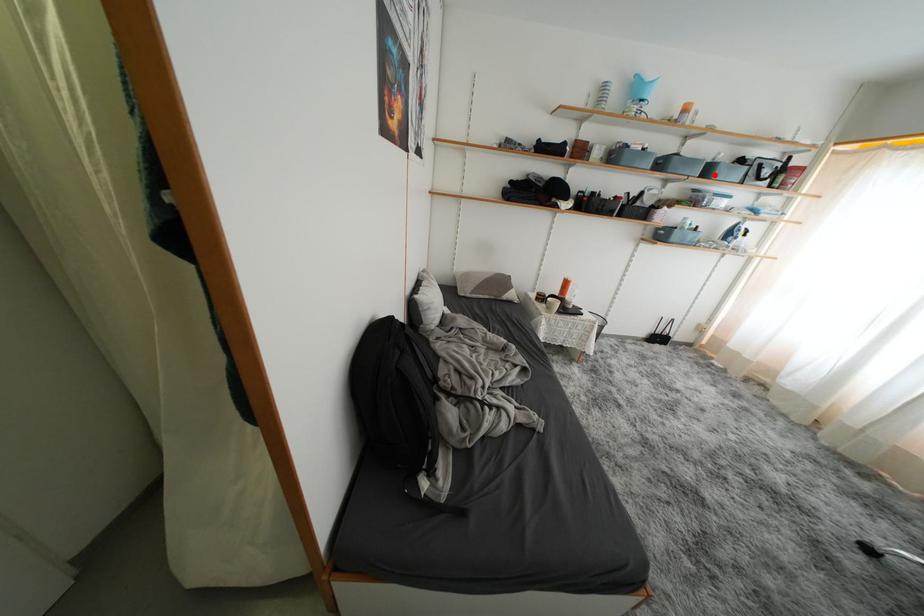
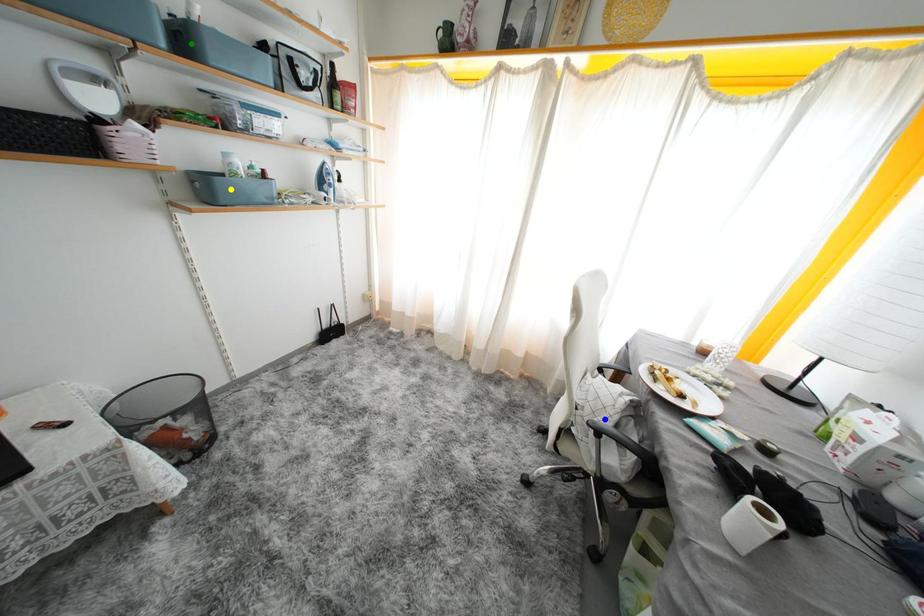
Question: I am providing you with two images of the same scene from different viewpoints. A red point is marked on the first image. You are given multiple points on the second image. Can you choose the point in image 2 that corresponds to the point in image 1?

Choices:
 (A) blue point
 (B) green point
 (C) yellow point

Answer: (B)